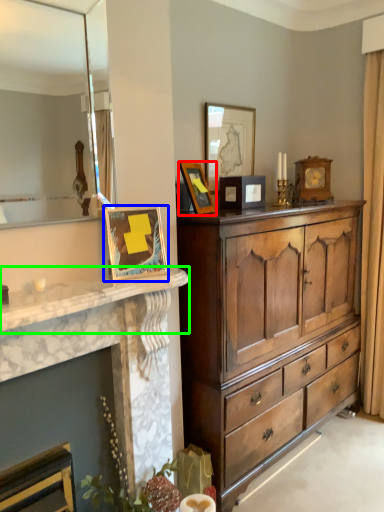
Question: Which object is the closest to the picture frame (highlighted by a red box)? Choose among these: picture frame (highlighted by a blue box) or countertop (highlighted by a green box).

Choices:
 (A) picture frame
 (B) countertop

Answer: (A)